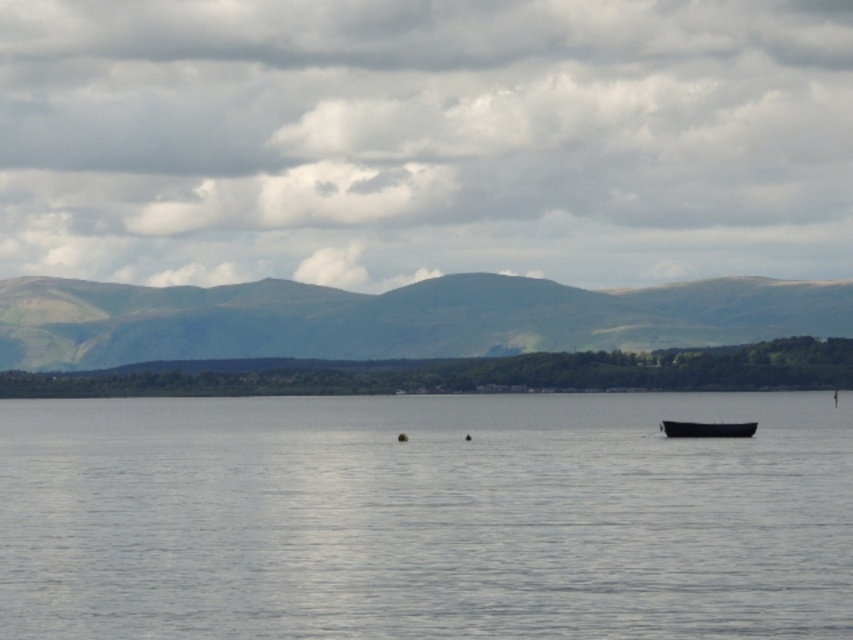
Which is in front, point (294, 342) or point (746, 432)?

Point (746, 432)

The width and height of the screenshot is (853, 640). What do you see at coordinates (395, 317) in the screenshot?
I see `green grassy mountain at center` at bounding box center [395, 317].

Is point (621, 310) positioned after point (717, 422)?

Yes, point (621, 310) is farther from viewer.

This screenshot has width=853, height=640. I want to click on green grassy mountain at center, so click(395, 317).

Image resolution: width=853 pixels, height=640 pixels. What do you see at coordinates (425, 516) in the screenshot?
I see `smooth gray water at center` at bounding box center [425, 516].

Is point (218, 502) positioned in front of point (717, 429)?

Yes, point (218, 502) is in front of point (717, 429).

Who is more forward, [810,509] or [683,433]?

Point [810,509] is more forward.

The image size is (853, 640). I want to click on smooth gray water at center, so (x=425, y=516).

Can you confirm if smooth gray water at center is taller than green grassy mountain at center?

No.

The width and height of the screenshot is (853, 640). I want to click on smooth gray water at center, so click(425, 516).

The height and width of the screenshot is (640, 853). Find the location of `smooth gray water at center`. smooth gray water at center is located at coordinates (425, 516).

The width and height of the screenshot is (853, 640). What are the coordinates of `smooth gray water at center` in the screenshot? It's located at (425, 516).